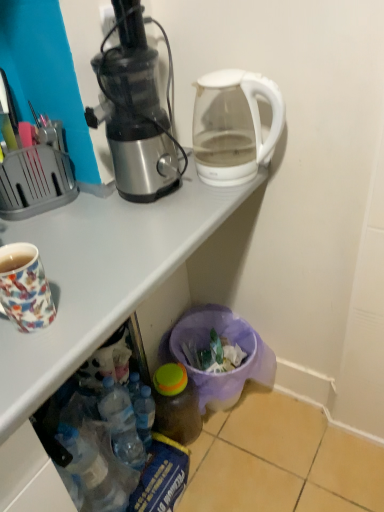
In order to click on vacant space in front of transparent glass kettle at upper right in this screenshot , I will do `click(203, 212)`.